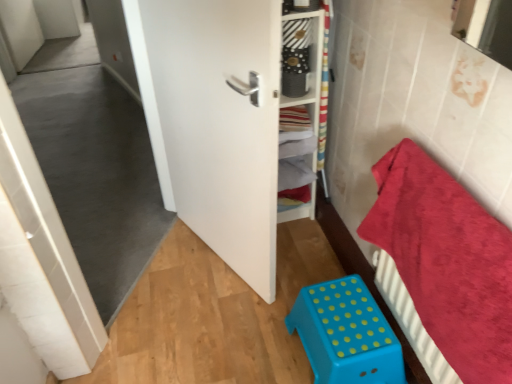
Where is `blank space situated above blue plastic stool at lower center (from a real-world perspective)`? blank space situated above blue plastic stool at lower center (from a real-world perspective) is located at coordinates (347, 317).